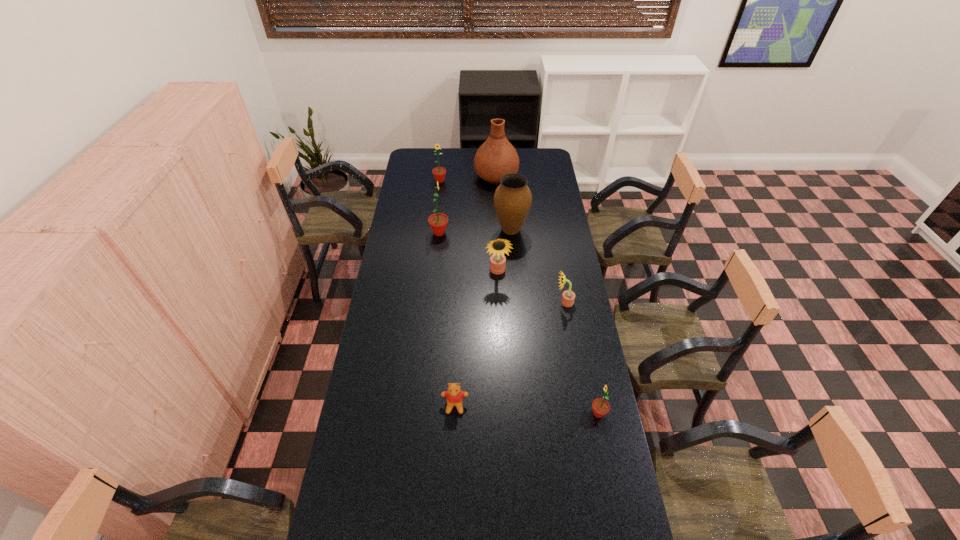
Where is `pitcher`? This screenshot has width=960, height=540. pitcher is located at coordinates (496, 157).

Locate an element on the screen. the tallest sunflower is located at coordinates 438,222.

In order to click on the second nearest green sunflower in this screenshot , I will do [x=438, y=222].

You are a GUI agent. You are given a task and a screenshot of the screen. Output one action in this format:
    pyautogui.click(x=<x>, y=<y>)
    Task: Click on the urn
    The image size is (960, 540).
    Given the screenshot: What is the action you would take?
    pyautogui.click(x=512, y=199)

Identify the location of the second smallest green sunflower. This screenshot has width=960, height=540. (439, 173).

Identify the location of the farthest green sunflower. This screenshot has height=540, width=960. (439, 173).

At what (x,y) coordinates should I click in order to perform the action: click on the fifth farthest object. Please return your answer as a coordinate pair (x, y). This screenshot has height=540, width=960. Looking at the image, I should click on (497, 261).

Where is `the third sunflower from right to left`? This screenshot has height=540, width=960. the third sunflower from right to left is located at coordinates (497, 261).

Where is `the right yellow sunflower`? The image size is (960, 540). the right yellow sunflower is located at coordinates (568, 297).

Identify the location of the third nearest object. (568, 297).